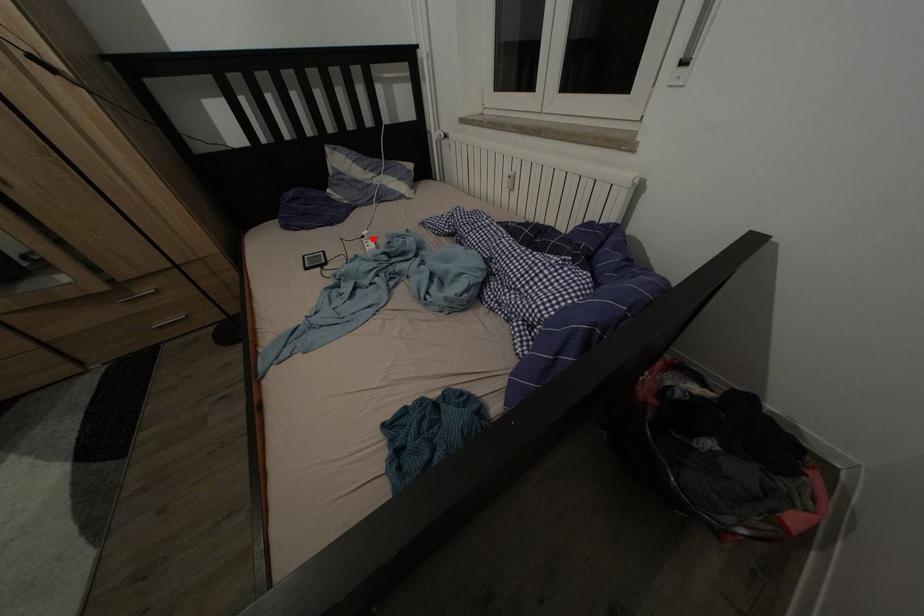
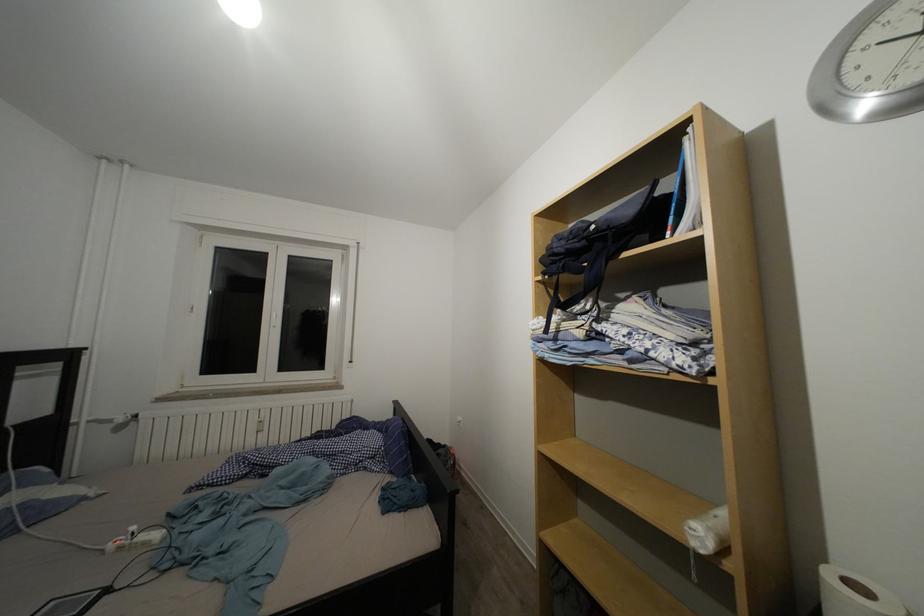
Question: A red point is marked in image1. In image2, is the corresponding 3D point closer to the camera or farther? Reply with the corresponding letter.

Choices:
 (A) The corresponding 3D point is closer.
 (B) The corresponding 3D point is farther.

Answer: (A)